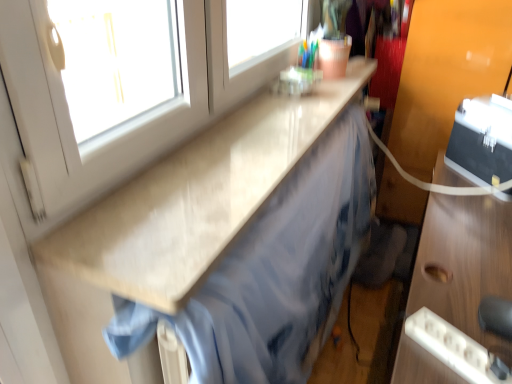
Image resolution: width=512 pixels, height=384 pixels. In order to click on empty space that is ontop of light beige laminate countertop at upper center in this screenshot , I will do [246, 151].